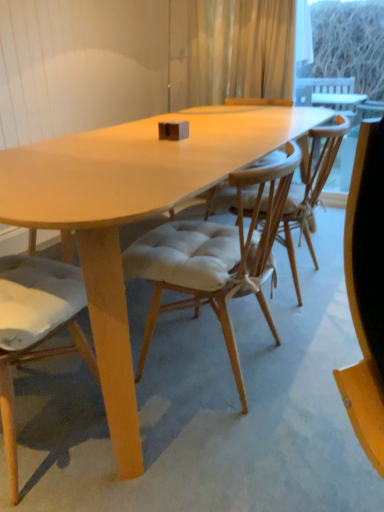
Question: Which direction should I rotate to look at light beige fabric chair at center, the 1th chair when ordered from right to left, — up or down?

Choices:
 (A) up
 (B) down

Answer: (B)

Question: Is light brown wood chair at center, the 2th chair viewed from the right, at the back of transparent glass window screen at upper right?

Choices:
 (A) yes
 (B) no

Answer: (B)

Question: Considering the relative sizes of transparent glass window screen at upper right and light brown wood chair at center, the 2th chair viewed from the right, in the image provided, is transparent glass window screen at upper right smaller than light brown wood chair at center, the 2th chair viewed from the right,?

Choices:
 (A) yes
 (B) no

Answer: (A)

Question: Is transparent glass window screen at upper right next to light brown wood chair at center, the 2th chair viewed from the right, and touching it?

Choices:
 (A) yes
 (B) no

Answer: (B)

Question: Does transparent glass window screen at upper right have a greater height compared to light brown wood chair at center, the 2th chair viewed from the right?

Choices:
 (A) yes
 (B) no

Answer: (A)

Question: Can you confirm if transparent glass window screen at upper right is bigger than light brown wood chair at center, the 2th chair viewed from the right?

Choices:
 (A) no
 (B) yes

Answer: (A)

Question: From the image's perspective, is transparent glass window screen at upper right under light brown wood chair at center, the 2th chair viewed from the right?

Choices:
 (A) yes
 (B) no

Answer: (B)

Question: Does translucent fabric curtain at upper center have a larger size compared to transparent glass window screen at upper right?

Choices:
 (A) no
 (B) yes

Answer: (B)

Question: From the image's perspective, would you say translucent fabric curtain at upper center is positioned over transparent glass window screen at upper right?

Choices:
 (A) yes
 (B) no

Answer: (B)

Question: Is the position of translucent fabric curtain at upper center less distant than that of transparent glass window screen at upper right?

Choices:
 (A) yes
 (B) no

Answer: (A)

Question: Would you consider translucent fabric curtain at upper center to be distant from transparent glass window screen at upper right?

Choices:
 (A) no
 (B) yes

Answer: (B)

Question: From a real-world perspective, is translucent fabric curtain at upper center located beneath transparent glass window screen at upper right?

Choices:
 (A) yes
 (B) no

Answer: (B)

Question: Is translucent fabric curtain at upper center taller than transparent glass window screen at upper right?

Choices:
 (A) no
 (B) yes

Answer: (A)

Question: Considering the relative sizes of transparent glass window screen at upper right and translucent fabric curtain at upper center in the image provided, is transparent glass window screen at upper right smaller than translucent fabric curtain at upper center?

Choices:
 (A) no
 (B) yes

Answer: (B)